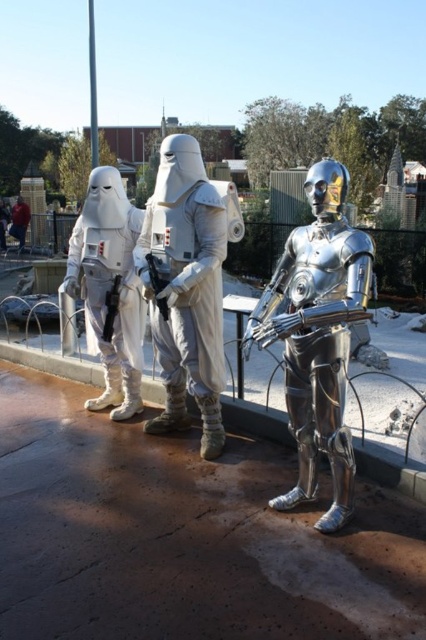
Which is behind, point (348, 502) or point (17, 205)?

Point (17, 205)

Which of these two, shiny metallic robot at center or white matte/soft fabric at center, stands shorter?

Standing shorter between the two is shiny metallic robot at center.

The image size is (426, 640). In order to click on shiny metallic robot at center in this screenshot , I will do `click(317, 337)`.

Locate an element on the screen. The height and width of the screenshot is (640, 426). shiny metallic robot at center is located at coordinates (317, 337).

Is white matte stormtrooper at left above white matte/soft fabric at center?

No, white matte stormtrooper at left is not above white matte/soft fabric at center.

Who is positioned more to the left, white matte stormtrooper at left or white matte/soft fabric at center?

white matte/soft fabric at center

Does point (138, 346) come behind point (23, 216)?

No, (138, 346) is closer to viewer.

You are a GUI agent. You are given a task and a screenshot of the screen. Output one action in this format:
    pyautogui.click(x=<x>, y=<y>)
    Task: Click on the white matte stormtrooper at left
    
    Given the screenshot: What is the action you would take?
    pyautogui.click(x=109, y=289)

Which is below, shiny metallic robot at center or white matte armor at center?

shiny metallic robot at center

Who is taller, shiny metallic robot at center or white matte armor at center?

→ Standing taller between the two is white matte armor at center.

Does point (290, 358) lie in front of point (212, 330)?

Yes, it is in front of point (212, 330).

Find the location of a particular element. shiny metallic robot at center is located at coordinates (317, 337).